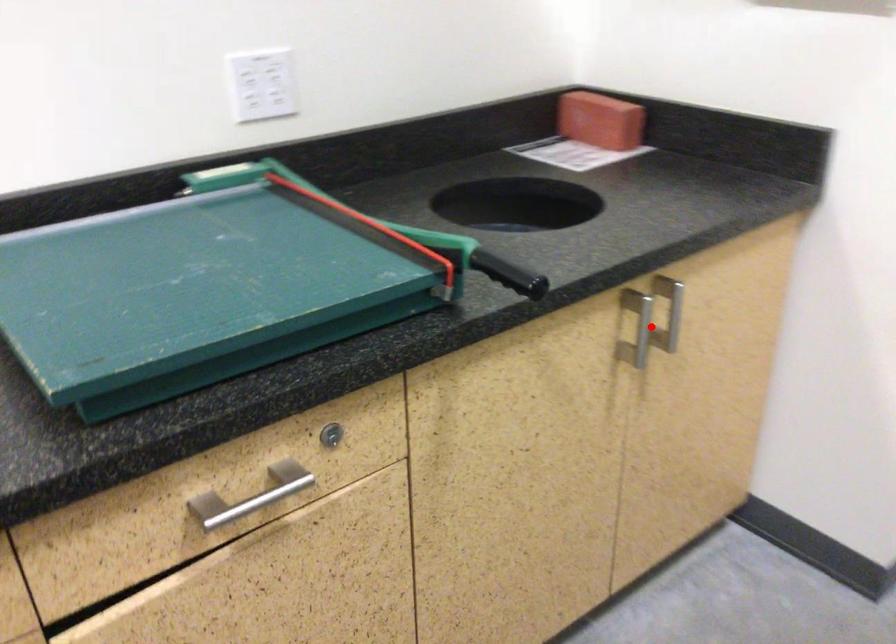
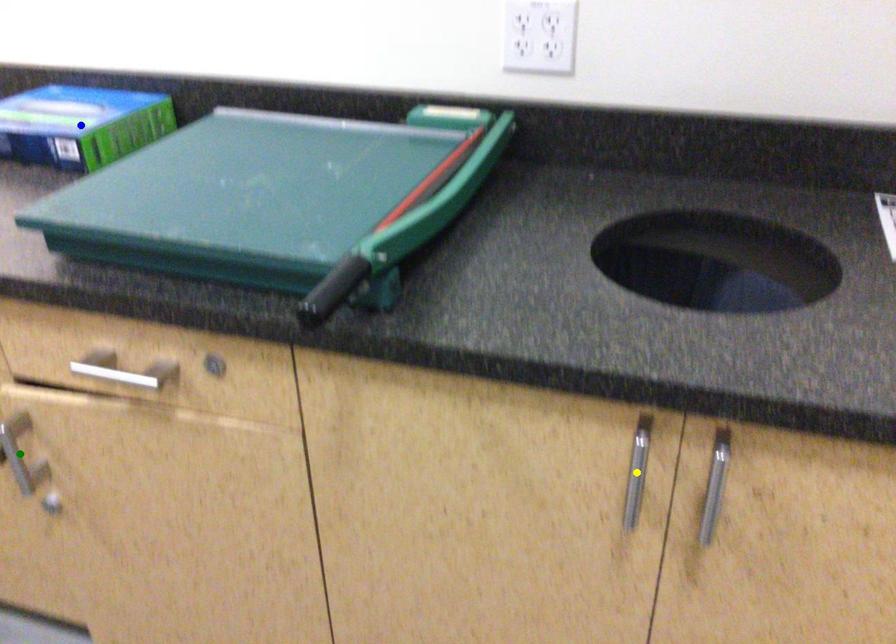
Question: I am providing you with two images of the same scene from different viewpoints. A red point is marked on the first image. You are given multiple points on the second image. In image 2, which mark is for the same physical point as the one in image 1?

Choices:
 (A) green point
 (B) yellow point
 (C) blue point

Answer: (B)